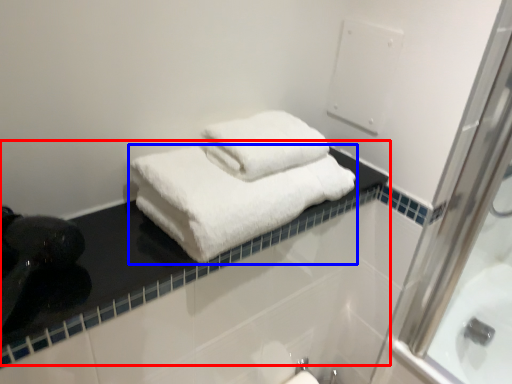
Question: Which of the following is the farthest to the observer, counter top (highlighted by a red box) or towel (highlighted by a blue box)?

Choices:
 (A) counter top
 (B) towel

Answer: (B)